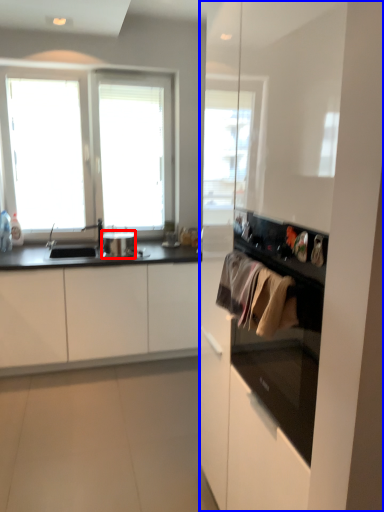
Question: Which object is further to the camera taking this photo, appliance (highlighted by a red box) or dresser (highlighted by a blue box)?

Choices:
 (A) appliance
 (B) dresser

Answer: (A)